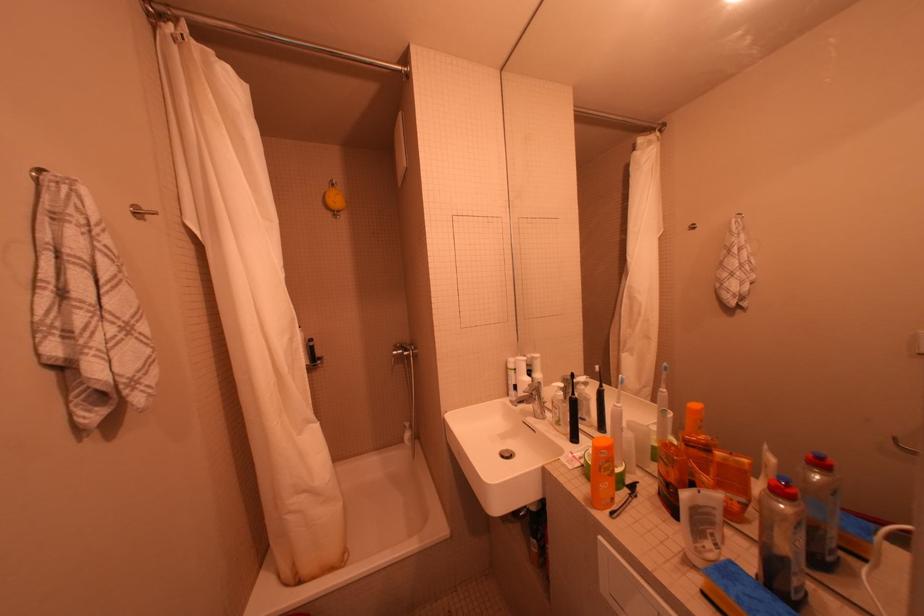
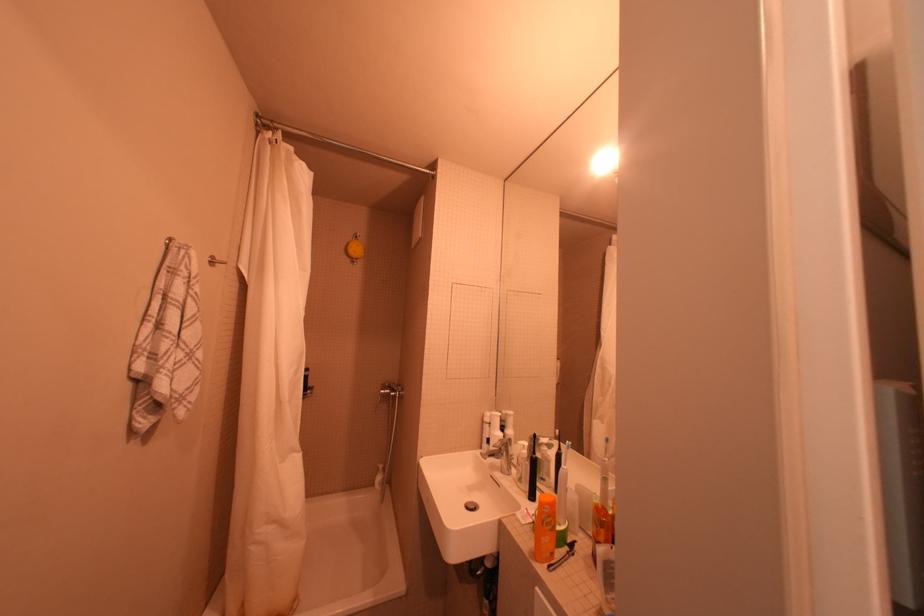
Where in the second image is the point corresponding to [591,505] from the first image?

(536, 557)